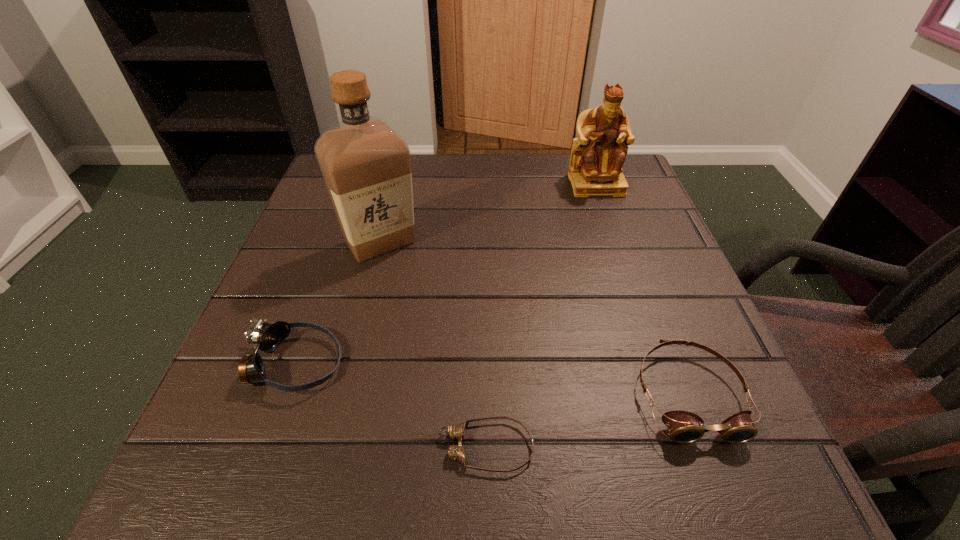
What are the coordinates of `liquor` in the screenshot? It's located at (366, 166).

This screenshot has height=540, width=960. I want to click on the tallest object, so click(366, 166).

At what (x,y) coordinates should I click in order to perform the action: click on figurine. Please return your answer as a coordinate pair (x, y). The image size is (960, 540). Looking at the image, I should click on (598, 154).

Where is `the farthest object`? This screenshot has width=960, height=540. the farthest object is located at coordinates (598, 154).

At what (x,y) coordinates should I click in order to perform the action: click on the leftmost goggles. Please return your answer as a coordinate pair (x, y). Looking at the image, I should click on (266, 337).

The image size is (960, 540). In order to click on the rightmost goggles in this screenshot , I will do `click(684, 427)`.

This screenshot has width=960, height=540. Find the location of `the shortest goggles`. the shortest goggles is located at coordinates click(x=456, y=452).

Where is `the second goggles from left to right`? The height and width of the screenshot is (540, 960). the second goggles from left to right is located at coordinates (456, 452).

You are a GUI agent. You are given a task and a screenshot of the screen. Output one action in this format:
    pyautogui.click(x=<x>, y=<y>)
    Task: Click on the vacant space located 0.130m on the front-facing side of the tallest object
    This screenshot has height=540, width=960.
    Given the screenshot: What is the action you would take?
    pyautogui.click(x=361, y=319)

Identify the location of vacant region located on the front-facing side of the fourth shortest object. (622, 259).